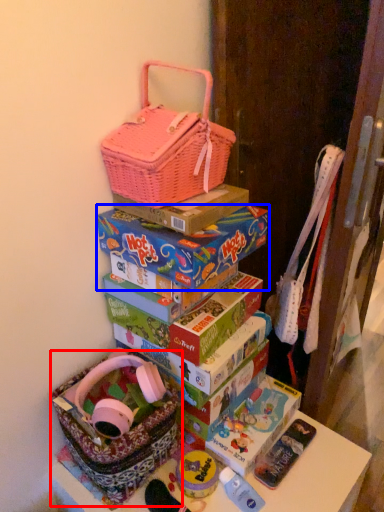
Question: Which object is further to the camera taking this photo, gift basket (highlighted by a red box) or box (highlighted by a blue box)?

Choices:
 (A) gift basket
 (B) box

Answer: (B)